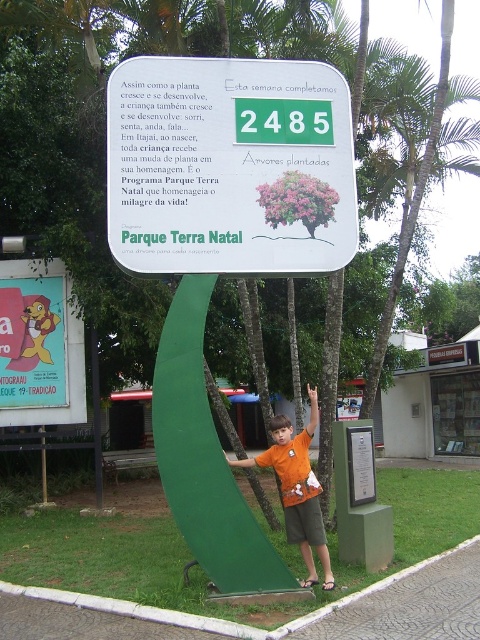
You are standing at the entrance of the park and want to find the white plastic sign at center. Based on the coordinates provided, where should you look relative to your current position?

The white plastic sign at center is located at coordinates point (229, 166). Since coordinates typically represent positions on a grid, you should look towards the lower left direction from your current position as lower values in both x and y coordinates indicate a position towards the bottom left of the frame.

You are a visitor standing in front of the signboard. You notice the orange cotton shirt at center and the white plastic sign at center. Which object is closer to you?

The white plastic sign at center is closer to you because the orange cotton shirt at center is behind it.

You are a visitor at the park and see both the white plastic sign at center and the orange cotton shirt at center. From your perspective, which object is positioned to the right?

The orange cotton shirt at center is positioned to the right of the white plastic sign at center.